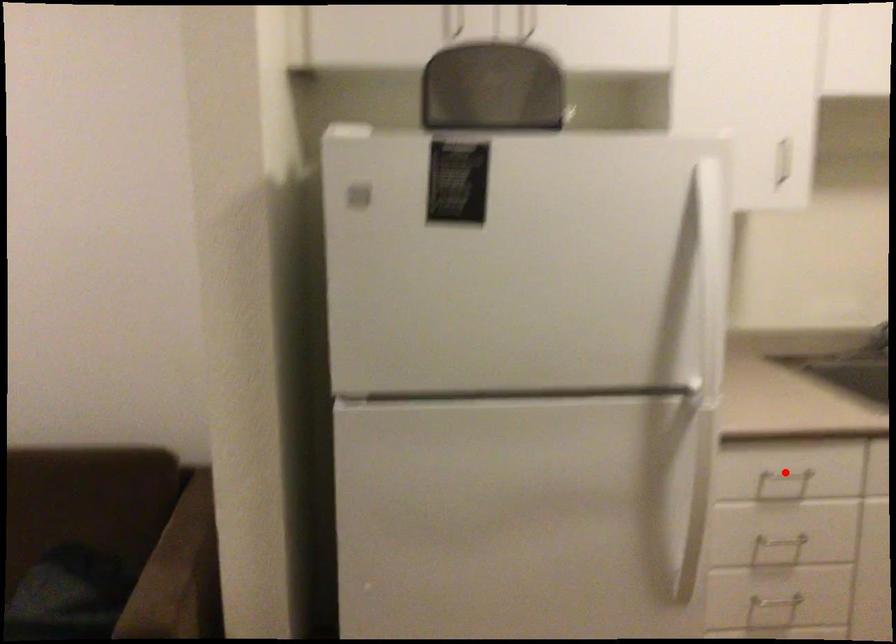
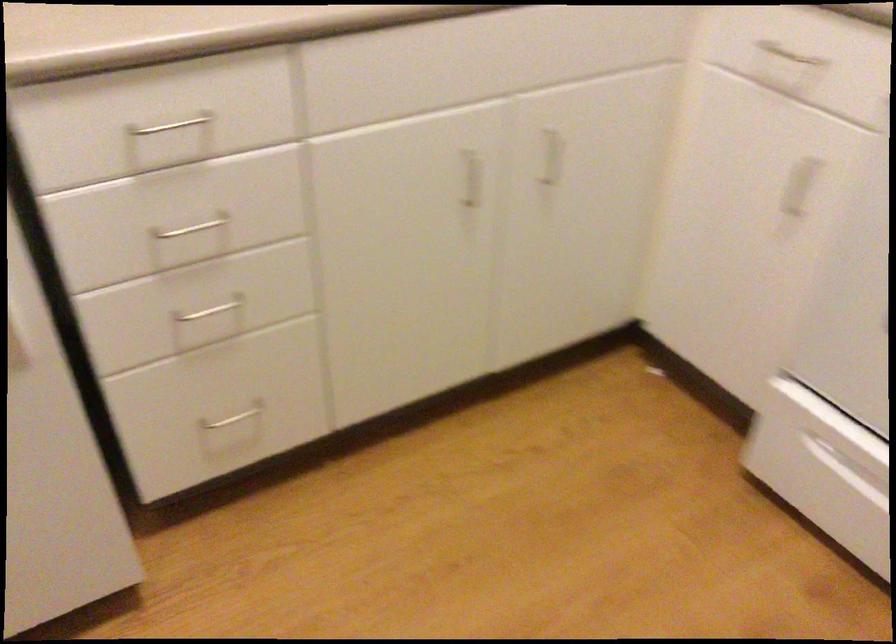
Question: I am providing you with two images of the same scene from different viewpoints. A red point is shown in image1. For the corresponding object point in image2, is it positioned nearer or farther from the camera?

Choices:
 (A) Nearer
 (B) Farther

Answer: (A)